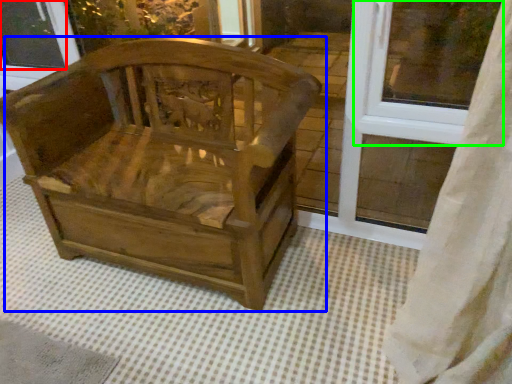
Question: Which object is the farthest from window screen (highlighted by a red box)? Choose among these: chair (highlighted by a blue box) or window frame (highlighted by a green box).

Choices:
 (A) chair
 (B) window frame

Answer: (B)